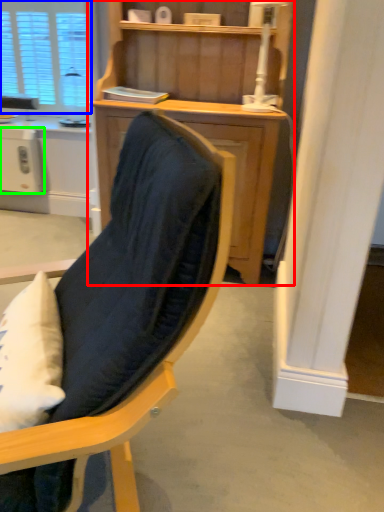
Question: Considering the real-world distances, which object is closest to cupboard (highlighted by a red box)? window (highlighted by a blue box) or appliance (highlighted by a green box).

Choices:
 (A) window
 (B) appliance

Answer: (B)